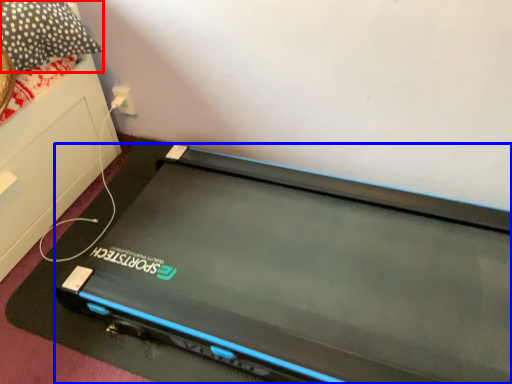
Question: Which point is further to the camera, pillow (highlighted by a red box) or computer (highlighted by a blue box)?

Choices:
 (A) pillow
 (B) computer

Answer: (A)